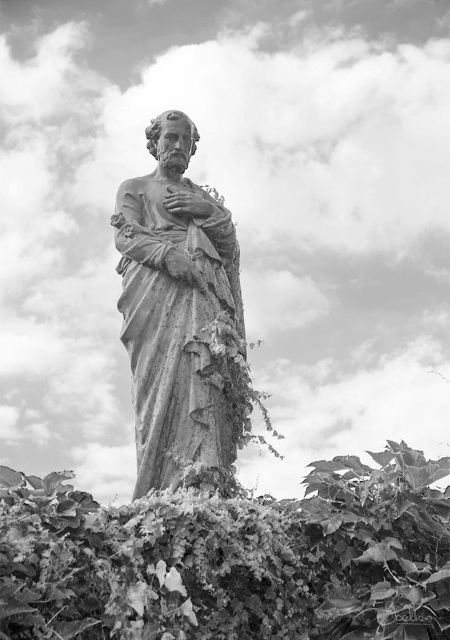
Question: Does leathery green leaves at center have a larger size compared to stone statue at center?

Choices:
 (A) no
 (B) yes

Answer: (A)

Question: Does leathery green leaves at center appear over stone statue at center?

Choices:
 (A) yes
 (B) no

Answer: (B)

Question: Does leathery green leaves at center appear on the right side of stone statue at center?

Choices:
 (A) no
 (B) yes

Answer: (B)

Question: Which point appears closest to the camera in this image?

Choices:
 (A) (190, 540)
 (B) (183, 220)

Answer: (A)